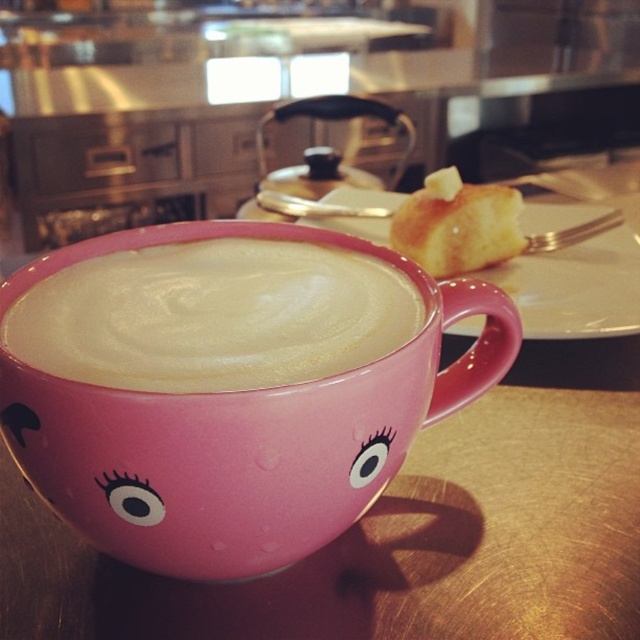
Question: Can you confirm if matte pink cup at center is positioned below buttery golden bread at upper right?

Choices:
 (A) yes
 (B) no

Answer: (A)

Question: Can you confirm if matte pink cup at center is wider than buttery golden bread at upper right?

Choices:
 (A) yes
 (B) no

Answer: (A)

Question: Can you confirm if pink glossy mug at center is wider than white matte plate at upper center?

Choices:
 (A) yes
 (B) no

Answer: (B)

Question: Estimate the real-world distances between objects in this image. Which object is farther from the buttery golden bread at upper right?

Choices:
 (A) white matte plate at upper center
 (B) pink glossy mug at center
 (C) matte pink cup at center

Answer: (B)

Question: Which of the following is the farthest from the observer?

Choices:
 (A) (388, 272)
 (B) (80, 509)
 (C) (321, 221)
 (D) (456, 260)

Answer: (C)

Question: Which object is the farthest from the matte pink cup at center?

Choices:
 (A) buttery golden bread at upper right
 (B) white matte plate at upper center

Answer: (A)